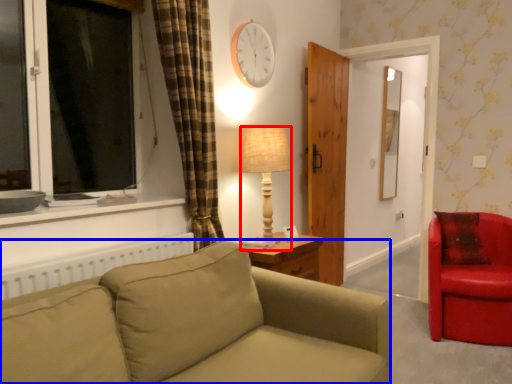
Question: Which of the following is the farthest to the observer, lamp (highlighted by a red box) or studio couch (highlighted by a blue box)?

Choices:
 (A) lamp
 (B) studio couch

Answer: (A)